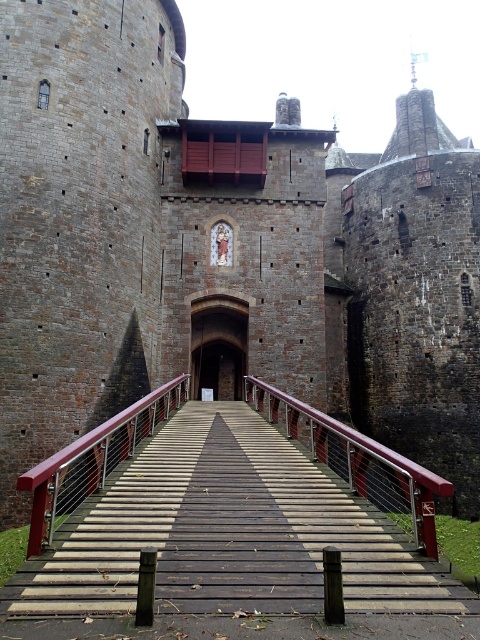
You are a knight approaching the castle entrance. You notice the wooden bridge at center and the brown stone archway at center. Which structure is directly above the other?

The brown stone archway at center is directly above the wooden bridge at center because the wooden bridge at center is positioned under it.

You are a knight approaching the castle entrance on horseback. Your horse is 2 meters long. Can you safely ride through the gap between the wooden bridge at center and the brown stone archway at center without any issues?

The wooden bridge at center and brown stone archway at center are 19.39 meters apart from each other. Since the horse is only 2 meters long, there is more than enough space for the knight to safely ride through the gap between the wooden bridge at center and the brown stone archway at center.

You are standing at the entrance of the medieval castle and want to cross the wooden bridge at center. Based on its position, can you determine if the bridge is directly in front of you or to the side?

The wooden bridge at center is located at point coordinates that place it directly in front of you, so yes, the bridge is directly in front of you.